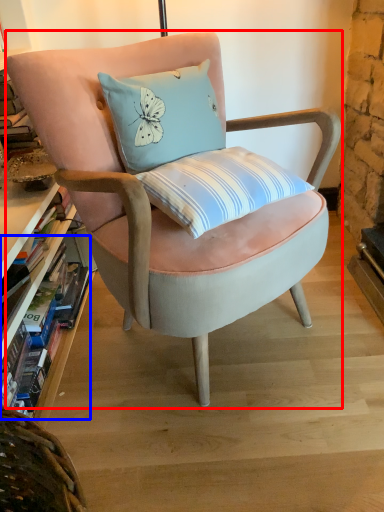
Question: Which object is further to the camera taking this photo, chair (highlighted by a red box) or book (highlighted by a blue box)?

Choices:
 (A) chair
 (B) book

Answer: (B)